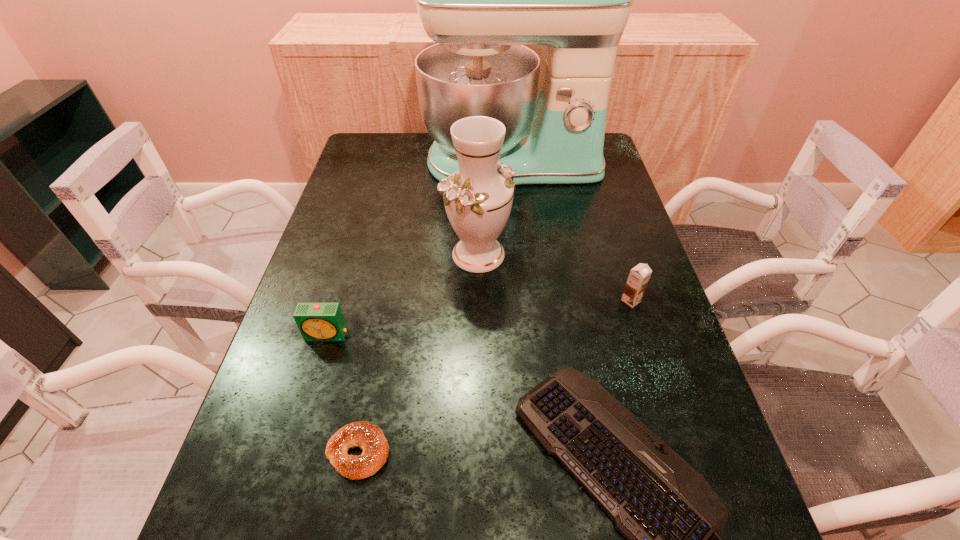
You are a GUI agent. You are given a task and a screenshot of the screen. Output one action in this format:
    pyautogui.click(x=<x>, y=<y>)
    Task: Click on the mixer
    
    Given the screenshot: What is the action you would take?
    pyautogui.click(x=481, y=0)

Where is `the tallest object`? The width and height of the screenshot is (960, 540). the tallest object is located at coordinates (481, 0).

Where is `the second farthest object`? This screenshot has height=540, width=960. the second farthest object is located at coordinates click(478, 198).

I want to click on vase, so click(x=478, y=198).

At what (x,y) coordinates should I click in order to perform the action: click on the fourth shortest object. Please return your answer as a coordinate pair (x, y). This screenshot has width=960, height=540. Looking at the image, I should click on (x=639, y=276).

Find the location of a particular element. The width and height of the screenshot is (960, 540). the third farthest object is located at coordinates (639, 276).

Image resolution: width=960 pixels, height=540 pixels. Find the location of `the leftmost object`. the leftmost object is located at coordinates (316, 321).

The width and height of the screenshot is (960, 540). I want to click on the fourth tallest object, so click(x=316, y=321).

The width and height of the screenshot is (960, 540). In order to click on bagel in this screenshot , I will do `click(367, 436)`.

Where is `free space located 0.210m at the base of the farthest object`? free space located 0.210m at the base of the farthest object is located at coordinates (520, 240).